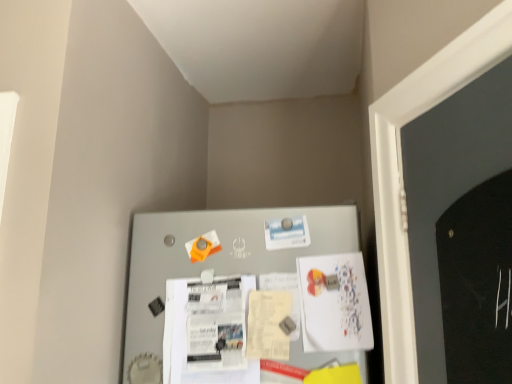
Question: Looking at their shapes, would you say metallic gray bulletin board at center is wider or thinner than white paper poster at center, positioned as the 1th poster in left-to-right order?

Choices:
 (A) wide
 (B) thin

Answer: (B)

Question: Is metallic gray bulletin board at center in front of or behind white paper poster at center, the 2th poster positioned from the right, in the image?

Choices:
 (A) behind
 (B) front

Answer: (B)

Question: Which object is positioned closest to the white paper poster at center, the first poster when ordered from right to left?

Choices:
 (A) white paper poster at center, positioned as the 1th poster in left-to-right order
 (B) metallic gray bulletin board at center

Answer: (B)

Question: Estimate the real-world distances between objects in this image. Which object is closer to the metallic gray bulletin board at center?

Choices:
 (A) white paper poster at center, positioned as the 1th poster in left-to-right order
 (B) white paper poster at center, the first poster when ordered from right to left

Answer: (A)